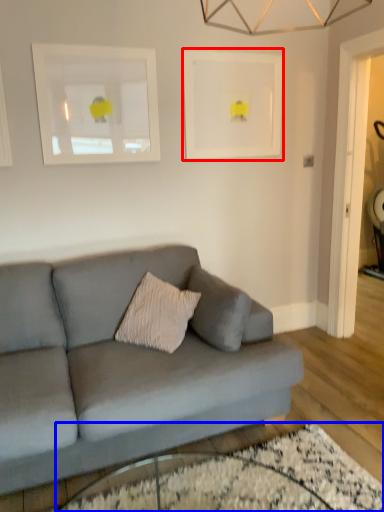
Question: Which object is closer to the camera taking this photo, picture frame (highlighted by a red box) or glass table (highlighted by a blue box)?

Choices:
 (A) picture frame
 (B) glass table

Answer: (B)